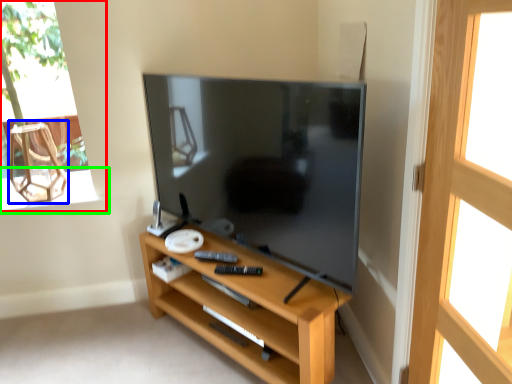
Question: Which is farther away from window (highlighted by a red box)? armchair (highlighted by a blue box) or window sill (highlighted by a green box)?

Choices:
 (A) armchair
 (B) window sill

Answer: (B)